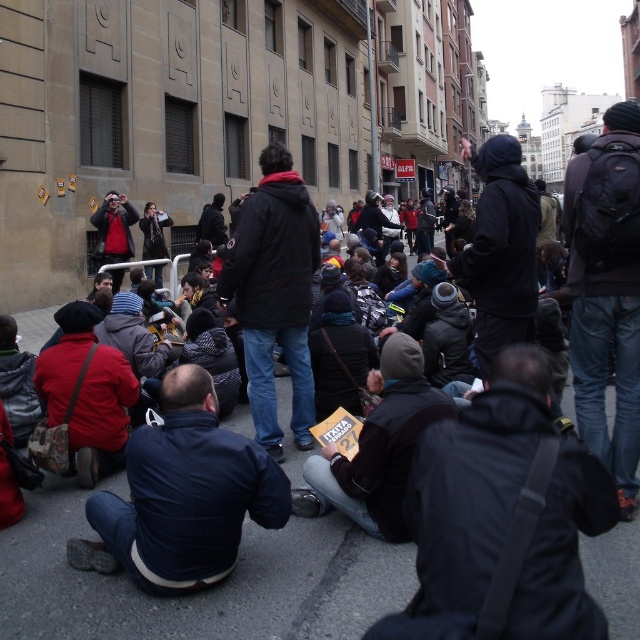
Question: Is dark gray asphalt at center bigger than black leather jacket at lower center?

Choices:
 (A) yes
 (B) no

Answer: (A)

Question: Which of the following is the closest to the observer?

Choices:
 (A) dark blue puffy jacket at lower left
 (B) dark gray asphalt at center

Answer: (B)

Question: Is black leather jacket at lower center above dark blue puffy jacket at lower left?

Choices:
 (A) no
 (B) yes

Answer: (B)

Question: Which object is positioned closest to the black leather jacket at lower center?

Choices:
 (A) dark gray asphalt at center
 (B) dark blue puffy jacket at lower left

Answer: (A)

Question: Can you confirm if black leather jacket at lower center is smaller than dark blue puffy jacket at lower left?

Choices:
 (A) yes
 (B) no

Answer: (A)

Question: Estimate the real-world distances between objects in this image. Which object is farther from the black leather jacket at lower center?

Choices:
 (A) dark blue puffy jacket at lower left
 (B) dark gray asphalt at center

Answer: (A)